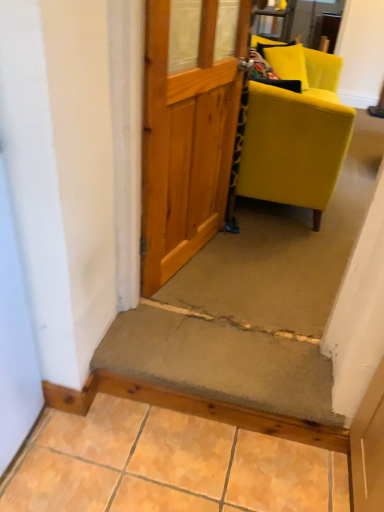
Question: Which direction should I rotate to face carpeted stairwell at center, the second stairwell when ordered from bottom to top, — up or down?

Choices:
 (A) down
 (B) up

Answer: (B)

Question: Considering the relative sizes of carpeted stairwell at center, positioned as the second stairwell in front-to-back order, and concrete textured step at center, which is the first stairwell in bottom-to-top order, in the image provided, is carpeted stairwell at center, positioned as the second stairwell in front-to-back order, smaller than concrete textured step at center, which is the first stairwell in bottom-to-top order,?

Choices:
 (A) yes
 (B) no

Answer: (B)

Question: Is carpeted stairwell at center, the second stairwell when ordered from bottom to top, bigger than concrete textured step at center, which is the first stairwell in bottom-to-top order?

Choices:
 (A) yes
 (B) no

Answer: (A)

Question: Is carpeted stairwell at center, acting as the first stairwell starting from the top, positioned beyond the bounds of concrete textured step at center, the second stairwell from the back?

Choices:
 (A) no
 (B) yes

Answer: (B)

Question: Can you confirm if carpeted stairwell at center, positioned as the second stairwell in front-to-back order, is thinner than concrete textured step at center, placed as the 2th stairwell when sorted from top to bottom?

Choices:
 (A) yes
 (B) no

Answer: (B)

Question: Is carpeted stairwell at center, positioned as the second stairwell in front-to-back order, next to concrete textured step at center, placed as the 2th stairwell when sorted from top to bottom?

Choices:
 (A) no
 (B) yes

Answer: (A)

Question: From a real-world perspective, is carpeted stairwell at center, marked as the first stairwell in a back-to-front arrangement, over concrete textured step at center, placed as the 2th stairwell when sorted from top to bottom?

Choices:
 (A) yes
 (B) no

Answer: (A)

Question: Does carpeted stairwell at center, positioned as the second stairwell in front-to-back order, turn towards matte yellow fabric chair at right?

Choices:
 (A) yes
 (B) no

Answer: (B)

Question: Does carpeted stairwell at center, the second stairwell when ordered from bottom to top, appear on the left side of matte yellow fabric chair at right?

Choices:
 (A) yes
 (B) no

Answer: (B)

Question: Can you confirm if carpeted stairwell at center, acting as the first stairwell starting from the top, is positioned to the right of matte yellow fabric chair at right?

Choices:
 (A) no
 (B) yes

Answer: (B)

Question: From a real-world perspective, is carpeted stairwell at center, acting as the first stairwell starting from the top, physically below matte yellow fabric chair at right?

Choices:
 (A) yes
 (B) no

Answer: (A)

Question: Is carpeted stairwell at center, the second stairwell when ordered from bottom to top, smaller than matte yellow fabric chair at right?

Choices:
 (A) yes
 (B) no

Answer: (A)

Question: Is carpeted stairwell at center, positioned as the second stairwell in front-to-back order, positioned in front of matte yellow fabric chair at right?

Choices:
 (A) no
 (B) yes

Answer: (B)

Question: Can we say smooth concrete step at lower center lies outside matte yellow fabric chair at right?

Choices:
 (A) no
 (B) yes

Answer: (B)